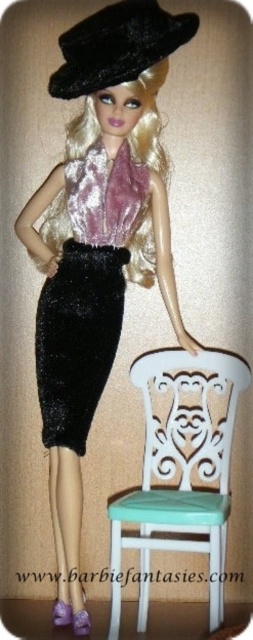
Question: Which object appears farthest from the camera in this image?

Choices:
 (A) velvet black skirt at center
 (B) white painted wood chair at lower center
 (C) black velvet hat at upper center

Answer: (A)

Question: Is velvet black skirt at center to the left of black velvet hat at upper center from the viewer's perspective?

Choices:
 (A) yes
 (B) no

Answer: (A)

Question: Which of the following is the closest to the observer?

Choices:
 (A) black velvet hat at upper center
 (B) velvet black skirt at center
 (C) white painted wood chair at lower center

Answer: (C)

Question: Does white painted wood chair at lower center have a smaller size compared to velvet black skirt at center?

Choices:
 (A) no
 (B) yes

Answer: (A)

Question: Which point is closer to the camera?

Choices:
 (A) velvet black skirt at center
 (B) white painted wood chair at lower center
 (C) black velvet hat at upper center

Answer: (B)

Question: Does white painted wood chair at lower center have a greater width compared to velvet black skirt at center?

Choices:
 (A) no
 (B) yes

Answer: (B)